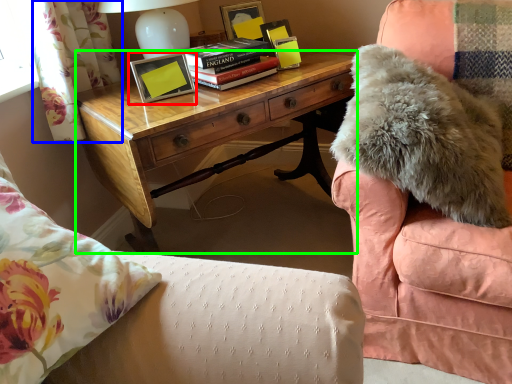
Question: Based on their relative distances, which object is farther from picture frame (highlighted by a red box)? Choose from curtain (highlighted by a blue box) and desk (highlighted by a green box).

Choices:
 (A) curtain
 (B) desk

Answer: (A)